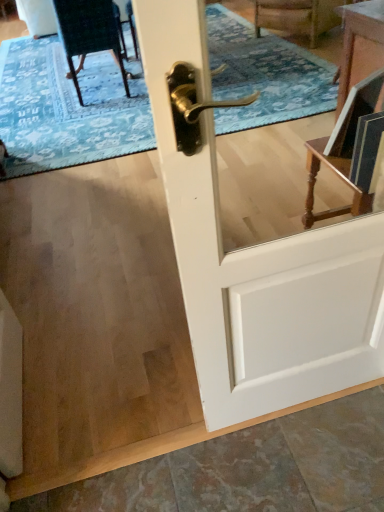
This screenshot has height=512, width=384. I want to click on blue textured rug at upper center, so click(66, 109).

Find the location of a particular element. This screenshot has height=512, width=384. velvet dark green chair at upper left is located at coordinates (88, 33).

Locate an element on the screen. The width and height of the screenshot is (384, 512). blue textured rug at upper center is located at coordinates (66, 109).

Considering the points (91, 47) and (230, 90), which point is behind, point (91, 47) or point (230, 90)?

The point (230, 90) is farther.

In terms of height, does velvet dark green chair at upper left look taller or shorter compared to blue textured rug at upper center?

Clearly, velvet dark green chair at upper left is taller compared to blue textured rug at upper center.

Considering the sizes of objects velvet dark green chair at upper left and blue textured rug at upper center in the image provided, who is bigger, velvet dark green chair at upper left or blue textured rug at upper center?

blue textured rug at upper center is bigger.

Is blue textured rug at upper center not near white glossy door at center?

Yes.

Is blue textured rug at upper center facing away from white glossy door at center?

blue textured rug at upper center does not have its back to white glossy door at center.

Considering the positions of objects blue textured rug at upper center and white glossy door at center in the image provided, who is more to the left, blue textured rug at upper center or white glossy door at center?

blue textured rug at upper center.

Which of these two, white glossy door at center or velvet dark green chair at upper left, is thinner?

Thinner between the two is white glossy door at center.

How far apart are white glossy door at center and velvet dark green chair at upper left?

white glossy door at center and velvet dark green chair at upper left are 8.99 feet apart from each other.

Considering the relative sizes of white glossy door at center and velvet dark green chair at upper left in the image provided, is white glossy door at center shorter than velvet dark green chair at upper left?

In fact, white glossy door at center may be taller than velvet dark green chair at upper left.

Is velvet dark green chair at upper left at the back of white glossy door at center?

No.

Looking at this image, based on their positions, is velvet dark green chair at upper left located to the left or right of white glossy door at center?

In the image, velvet dark green chair at upper left appears on the left side of white glossy door at center.

From a real-world perspective, who is located lower, velvet dark green chair at upper left or white glossy door at center?

velvet dark green chair at upper left.

What's the angular difference between velvet dark green chair at upper left and white glossy door at center's facing directions?

They differ by 0.319 degrees in their facing directions.

From the picture: Is velvet dark green chair at upper left located outside white glossy door at center?

velvet dark green chair at upper left is positioned outside white glossy door at center.

Can you confirm if blue textured rug at upper center is thinner than velvet dark green chair at upper left?

No, blue textured rug at upper center is not thinner than velvet dark green chair at upper left.

Between blue textured rug at upper center and velvet dark green chair at upper left, which one has less height?

blue textured rug at upper center is shorter.

Considering the relative positions of blue textured rug at upper center and velvet dark green chair at upper left in the image provided, is blue textured rug at upper center in front of velvet dark green chair at upper left?

Yes, blue textured rug at upper center is closer to the camera.

Could you tell me if blue textured rug at upper center is turned towards velvet dark green chair at upper left?

No, blue textured rug at upper center does not turn towards velvet dark green chair at upper left.

Is white glossy door at center aimed at blue textured rug at upper center?

Yes, white glossy door at center is turned towards blue textured rug at upper center.

Which object is positioned more to the right, white glossy door at center or blue textured rug at upper center?

Positioned to the right is white glossy door at center.

Based on the photo, can you confirm if white glossy door at center is thinner than blue textured rug at upper center?

Yes, white glossy door at center is thinner than blue textured rug at upper center.

Locate an element on the screen. chair located above the blue textured rug at upper center (from a real-world perspective) is located at coordinates (88, 33).

The image size is (384, 512). What are the coordinates of `door on the right of the blue textured rug at upper center` in the screenshot? It's located at (256, 261).

Based on their spatial positions, is velvet dark green chair at upper left or white glossy door at center further from blue textured rug at upper center?

Among the two, white glossy door at center is located further to blue textured rug at upper center.

When comparing their distances from velvet dark green chair at upper left, does white glossy door at center or blue textured rug at upper center seem closer?

blue textured rug at upper center lies closer to velvet dark green chair at upper left than the other object.

Which object lies further to the anchor point velvet dark green chair at upper left, blue textured rug at upper center or white glossy door at center?

Among the two, white glossy door at center is located further to velvet dark green chair at upper left.

Estimate the real-world distances between objects in this image. Which object is closer to blue textured rug at upper center, white glossy door at center or velvet dark green chair at upper left?

Among the two, velvet dark green chair at upper left is located nearer to blue textured rug at upper center.

Based on their spatial positions, is blue textured rug at upper center or velvet dark green chair at upper left further from white glossy door at center?

velvet dark green chair at upper left is further to white glossy door at center.

From the image, which object appears to be farther from white glossy door at center, velvet dark green chair at upper left or blue textured rug at upper center?

velvet dark green chair at upper left lies further to white glossy door at center than the other object.

You are a GUI agent. You are given a task and a screenshot of the screen. Output one action in this format:
    pyautogui.click(x=<x>, y=<y>)
    Task: Click on the doormat positioned between white glossy door at center and velvet dark green chair at upper left from near to far
    The image size is (384, 512).
    Given the screenshot: What is the action you would take?
    pyautogui.click(x=66, y=109)